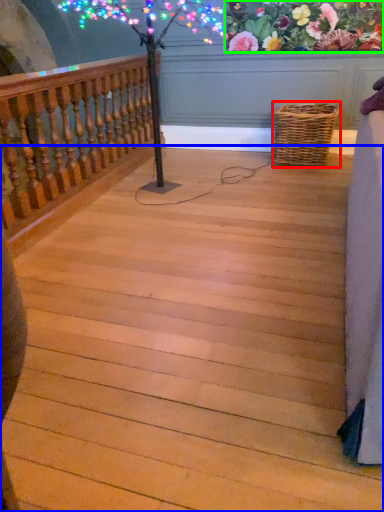
Question: Based on their relative distances, which object is nearer to picnic basket (highlighted by a red box)? Choose from stairs (highlighted by a blue box) and floral arrangement (highlighted by a green box).

Choices:
 (A) stairs
 (B) floral arrangement

Answer: (B)